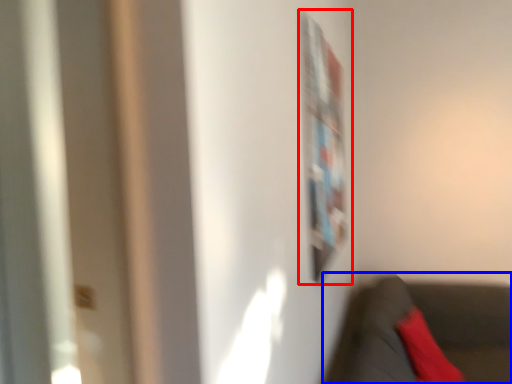
Question: Among these objects, which one is farthest to the camera, bulletin board (highlighted by a red box) or chair (highlighted by a blue box)?

Choices:
 (A) bulletin board
 (B) chair

Answer: (A)